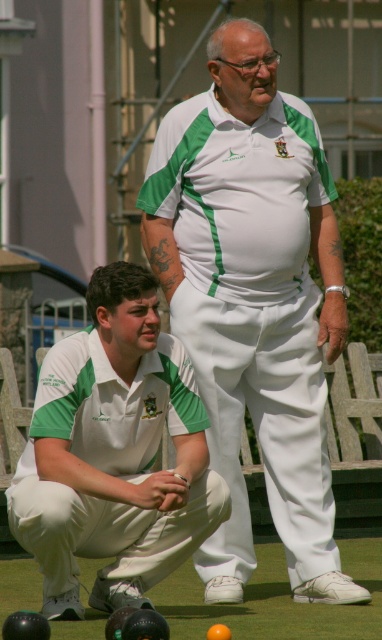
You are a photographer setting up a shot of the lawn bowls game. You want to focus on the white cotton shirt at center and the white cotton squat at lower left. Which object should you adjust your camera focus on first if you want to ensure both are in focus?

The white cotton shirt at center is further to the viewer than the white cotton squat at lower left. To ensure both are in focus, you should focus on the white cotton shirt at center first, as it is closer, and the depth of field will naturally include the farther object.

You are a photographer trying to capture a candid shot of the white cotton shirt at center. The camera is currently focused on the point at coordinates (254, 300). Is the white cotton shirt at center in focus?

Yes, the white cotton shirt at center is in focus because the camera is focused on the point at coordinates (254, 300), which indicates the location of the white cotton shirt at center.

You are a photographer trying to capture a photo of the white cotton shirt at center and the white cotton squat at lower left. Which object should you focus on first if you want to include both in the frame without moving the camera?

The white cotton shirt at center is much taller than the white cotton squat at lower left, so you should focus on the white cotton shirt at center first to ensure it fits within the frame.